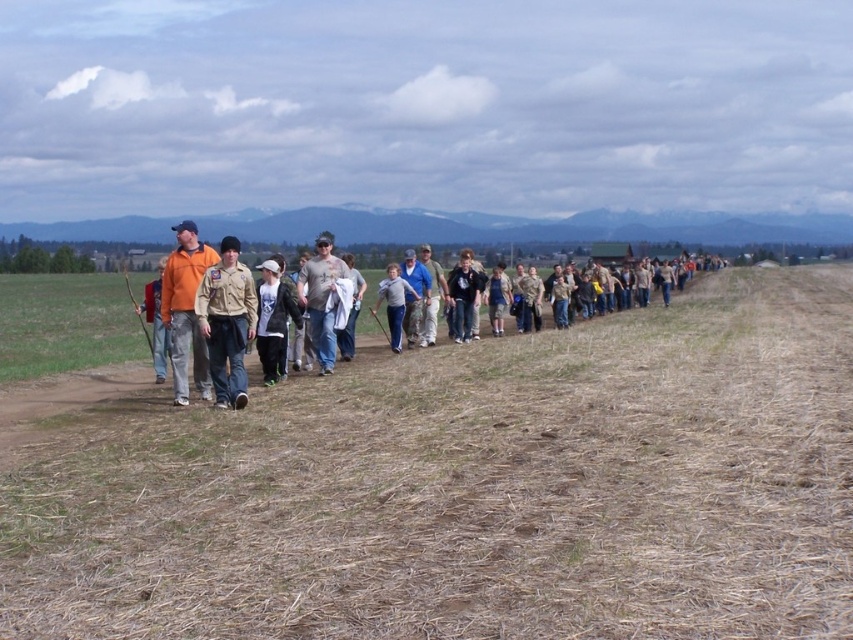
Is point (248, 294) less distant than point (399, 288)?

Yes, it is in front of point (399, 288).

Which is more to the right, khaki uniform at center or gray cotton shirt at center?

gray cotton shirt at center

Is point (228, 316) positioned in front of point (392, 336)?

Yes, point (228, 316) is closer to viewer.

In order to click on khaki uniform at center in this screenshot , I will do coord(227,323).

Measure the distance from brown dry grass at center to khaki uniform at center.

5.32 meters

Between point (280, 620) and point (233, 339), which one is positioned behind?

The point (233, 339) is behind.

The width and height of the screenshot is (853, 640). I want to click on brown dry grass at center, so click(473, 490).

Between khaki uniform at center and denim shorts at center, which one appears on the right side from the viewer's perspective?

From the viewer's perspective, denim shorts at center appears more on the right side.

Consider the image. Who is more forward, (224, 237) or (502, 314)?

Point (224, 237) is in front.

The image size is (853, 640). Find the location of `khaki uniform at center`. khaki uniform at center is located at coordinates pyautogui.click(x=227, y=323).